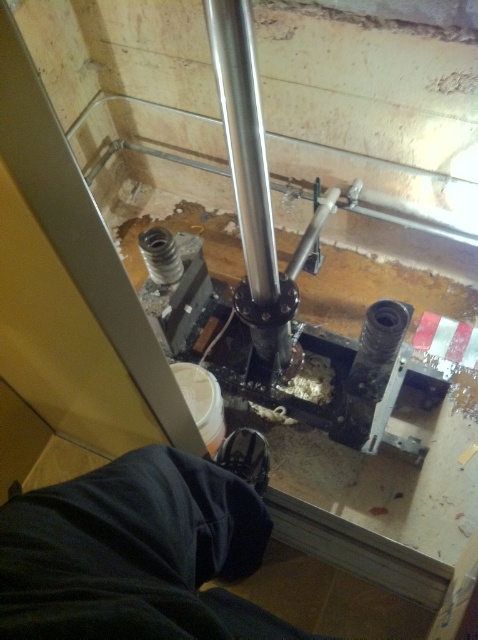
Who is more distant from viewer, (303,634) or (219,51)?

The point (303,634) is more distant.

Identify the location of dark blue fabric at lower left. (136, 554).

Which is behind, point (192, 504) or point (246, 17)?

The point (192, 504) is behind.

Locate an element on the screen. This screenshot has width=478, height=640. dark blue fabric at lower left is located at coordinates (136, 554).